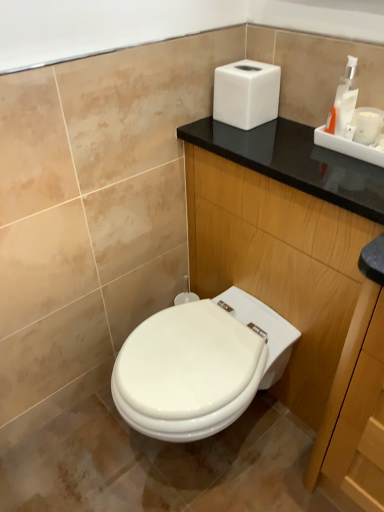
Question: Considering the positions of point (264, 113) and point (347, 108), is point (264, 113) closer or farther from the camera than point (347, 108)?

Choices:
 (A) closer
 (B) farther

Answer: (B)

Question: From a real-world perspective, is white matte hand dryer at upper right above or below white plastic soap dispenser at upper right?

Choices:
 (A) above
 (B) below

Answer: (B)

Question: Considering the real-world distances, which object is farthest from the white plastic soap dispenser at upper right?

Choices:
 (A) black wood dresser at upper right
 (B) white matte hand dryer at upper right

Answer: (A)

Question: Based on their relative distances, which object is farther from the black wood dresser at upper right?

Choices:
 (A) white matte hand dryer at upper right
 (B) white plastic soap dispenser at upper right

Answer: (B)